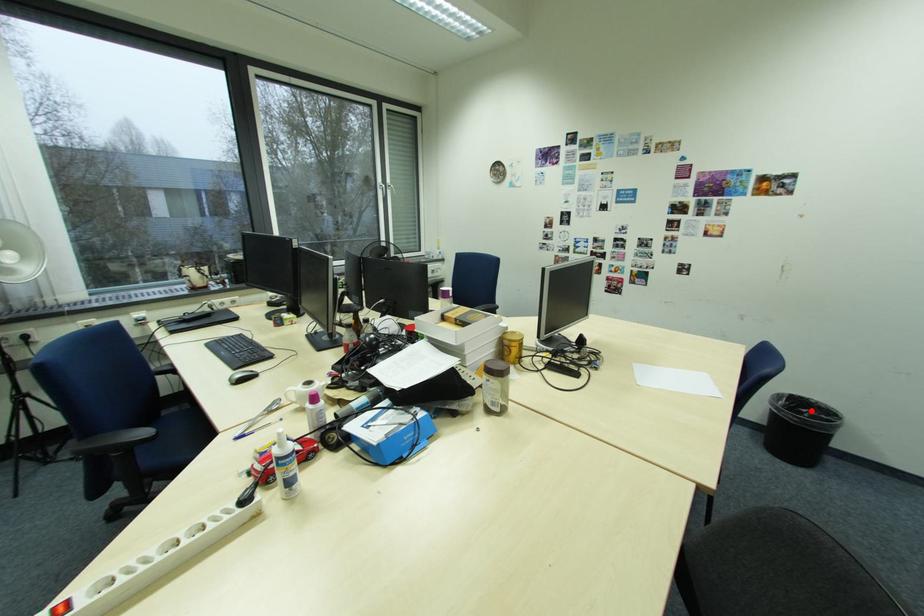
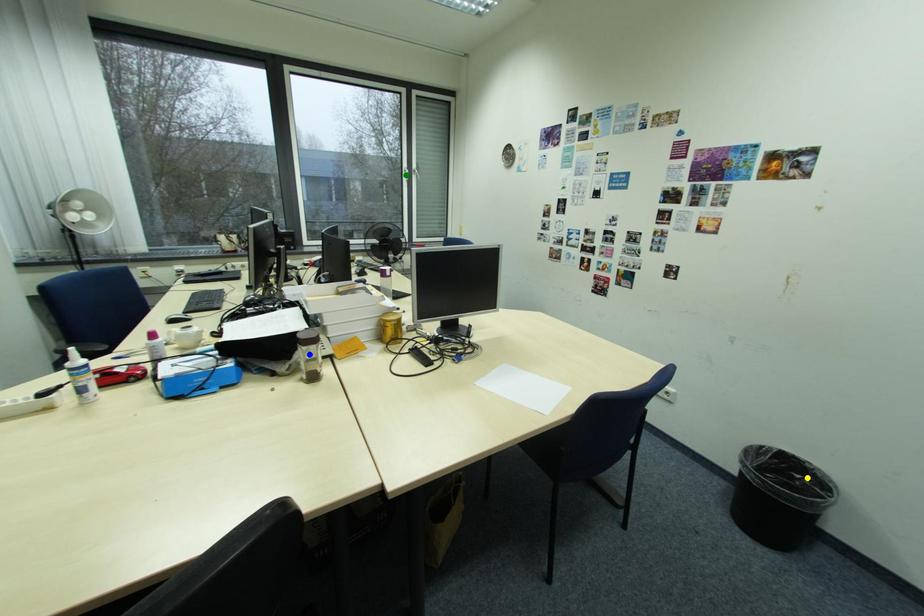
Question: I am providing you with two images of the same scene from different viewpoints. A red point is marked on the first image. You are given multiple points on the second image. Can you choose the point in image 2 that corresponds to the point in image 1?

Choices:
 (A) green point
 (B) blue point
 (C) yellow point

Answer: (C)